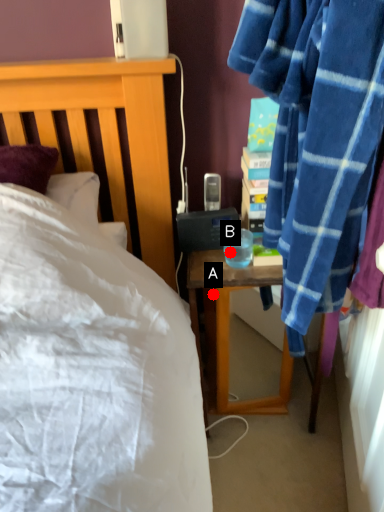
Question: Two points are circled on the image, labeled by A and B beside each circle. Among these points, which one is farthest from the camera?

Choices:
 (A) A is further
 (B) B is further

Answer: (A)